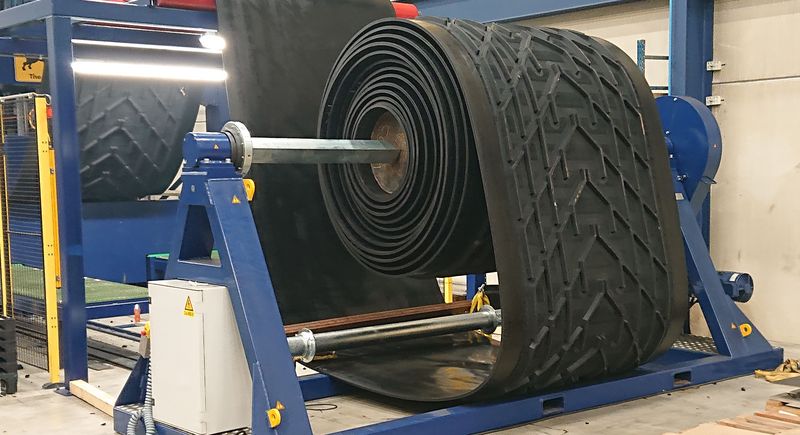
In order to click on horizontal support beam in this screenshot , I will do `click(497, 14)`.